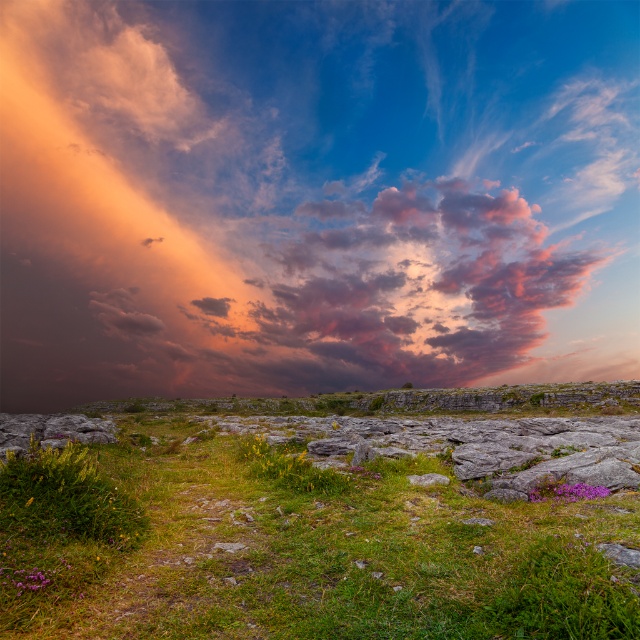
You are standing on the green grassy at lower center and want to look at the purple matte flower at lower right. Which direction should you turn your head to see it?

Since the green grassy at lower center is in front of the purple matte flower at lower right, you need to turn your head to the right to see the flower.